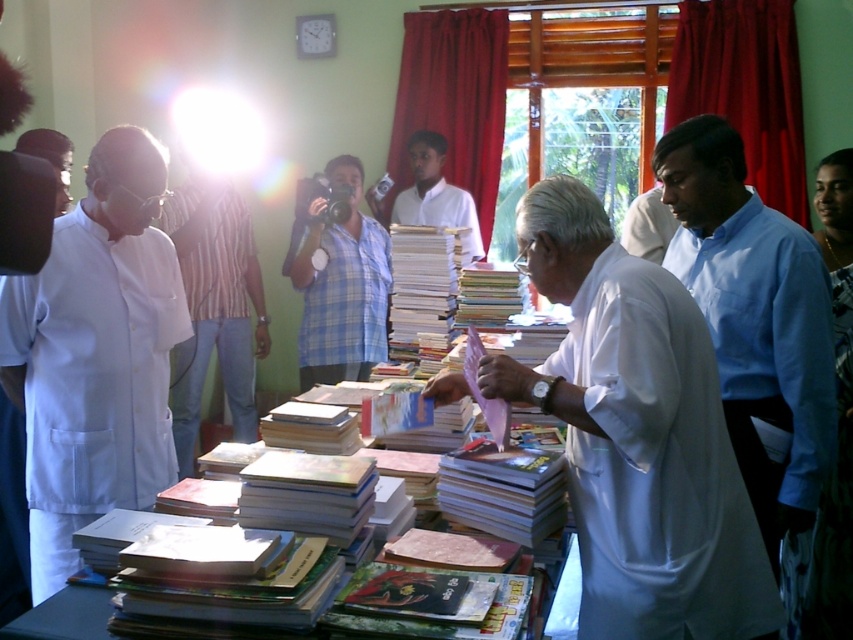
Looking at this image, you are standing in front of the table with books and want to place a new book between the two points marked as point (538, 252) and point (428, 172). Which point should you move towards to place the book closer to the camera?

To place the book closer to the camera, you should move towards point (538, 252) because it is closer to the camera than point (428, 172).

You are standing in the library scene and need to locate the white matte shirt at center. According to the coordinates provided, where exactly would you look to find it?

The white matte shirt at center is located at coordinates point (436,195).

You are standing in the library and see the white matte shirt at center and the white cloth at left. Which item is closer to you?

The white matte shirt at center is closer to you because the white cloth at left is behind it.